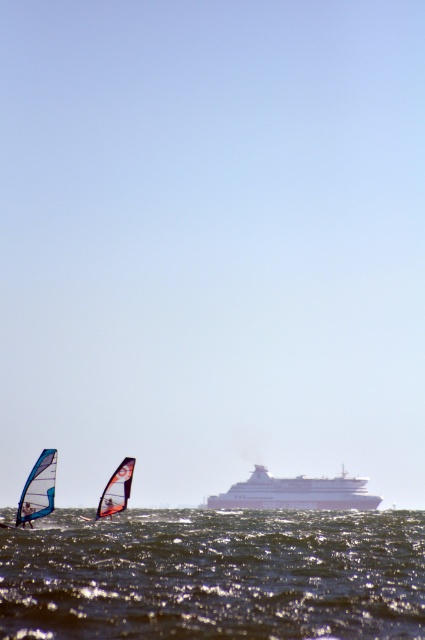
Question: Can you confirm if white matte sail at lower left is wider than white sail at center?

Choices:
 (A) no
 (B) yes

Answer: (B)

Question: In this image, where is shiny dark water at lower center located relative to white matte sail at lower left?

Choices:
 (A) left
 (B) right

Answer: (B)

Question: Which object is the farthest from the white glossy cruise ship at center?

Choices:
 (A) white sail at center
 (B) white matte sail at lower left
 (C) shiny dark water at lower center
 (D) translucent blue sail at lower left

Answer: (A)

Question: Which point appears farthest from the camera in this image?

Choices:
 (A) (260, 499)
 (B) (127, 461)
 (C) (275, 541)
 (D) (25, 492)

Answer: (A)

Question: Does white matte sail at lower left appear on the right side of white sail at center?

Choices:
 (A) no
 (B) yes

Answer: (B)

Question: Which object appears closest to the camera in this image?

Choices:
 (A) white matte sail at lower left
 (B) translucent blue sail at lower left

Answer: (B)